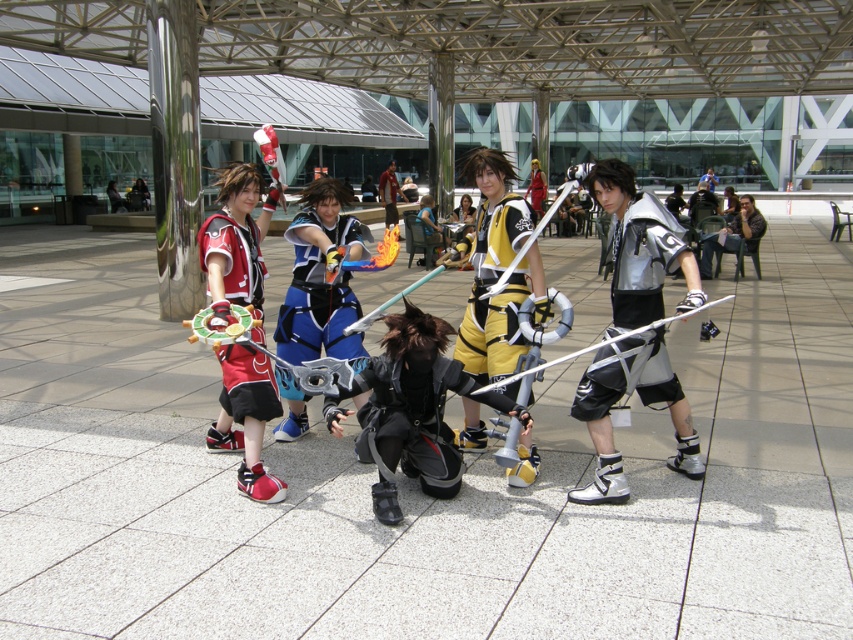
Is point (656, 362) positioned in front of point (409, 323)?

No, (656, 362) is further to viewer.

Which is behind, point (669, 372) or point (381, 365)?

Point (669, 372)

Locate an element on the screen. silver metallic armor at center is located at coordinates (x=640, y=248).

Does black matte armor at center have a greater height compared to dark brown leather jacket at center?

No, black matte armor at center is not taller than dark brown leather jacket at center.

Identify the location of black matte armor at center. The width and height of the screenshot is (853, 640). (410, 408).

Is point (331, 408) positioned in front of point (728, 234)?

Yes, point (331, 408) is closer to viewer.

Image resolution: width=853 pixels, height=640 pixels. I want to click on black matte armor at center, so (x=410, y=408).

In order to click on silver metallic armor at center in this screenshot , I will do `click(640, 248)`.